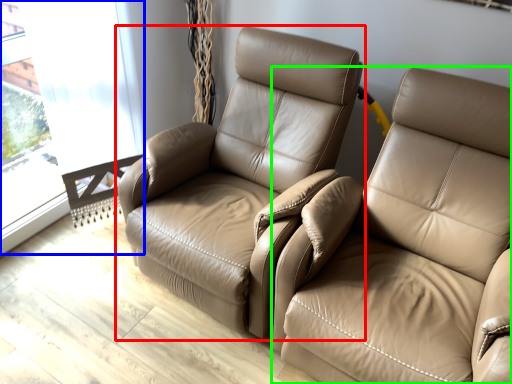
Question: Which is farther away from chair (highlighted by a red box)? window (highlighted by a blue box) or studio couch (highlighted by a green box)?

Choices:
 (A) window
 (B) studio couch

Answer: (A)